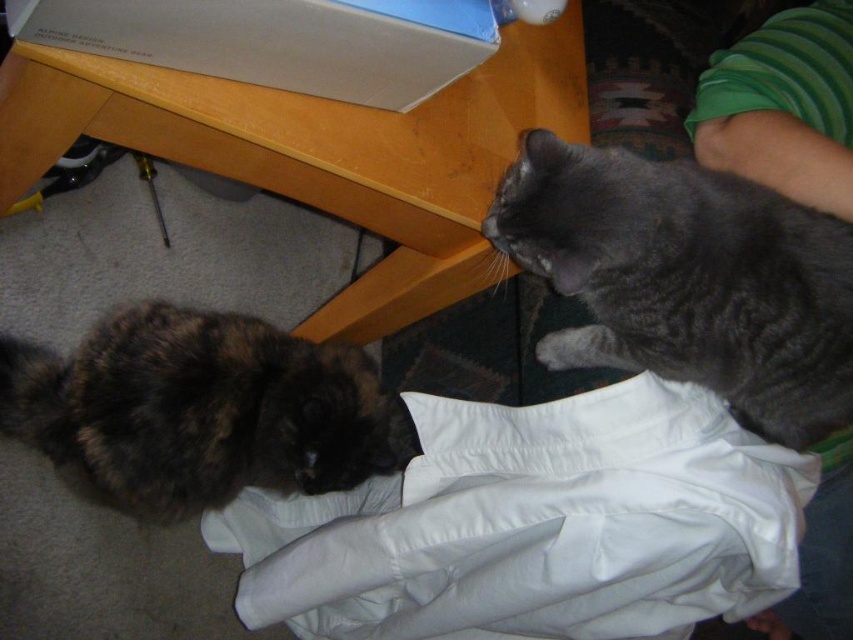
Question: Among these points, which one is farthest from the camera?

Choices:
 (A) (132, 336)
 (B) (389, 173)
 (C) (498, 506)
 (D) (567, 280)

Answer: (A)

Question: Which point is farther to the camera?

Choices:
 (A) (751, 596)
 (B) (485, 204)
 (C) (286, 349)

Answer: (C)

Question: Can you confirm if wooden table at lower center is positioned below fluffy tortoiseshell cat at lower left?

Choices:
 (A) no
 (B) yes

Answer: (A)

Question: Is wooden table at lower center smaller than gray fluffy cat at upper right?

Choices:
 (A) yes
 (B) no

Answer: (B)

Question: Which point is closer to the camera taking this photo?

Choices:
 (A) (581, 397)
 (B) (357, 90)
 (C) (650, 276)
 (D) (357, 348)

Answer: (C)

Question: Does wooden table at lower center appear under gray fluffy cat at upper right?

Choices:
 (A) no
 (B) yes

Answer: (A)